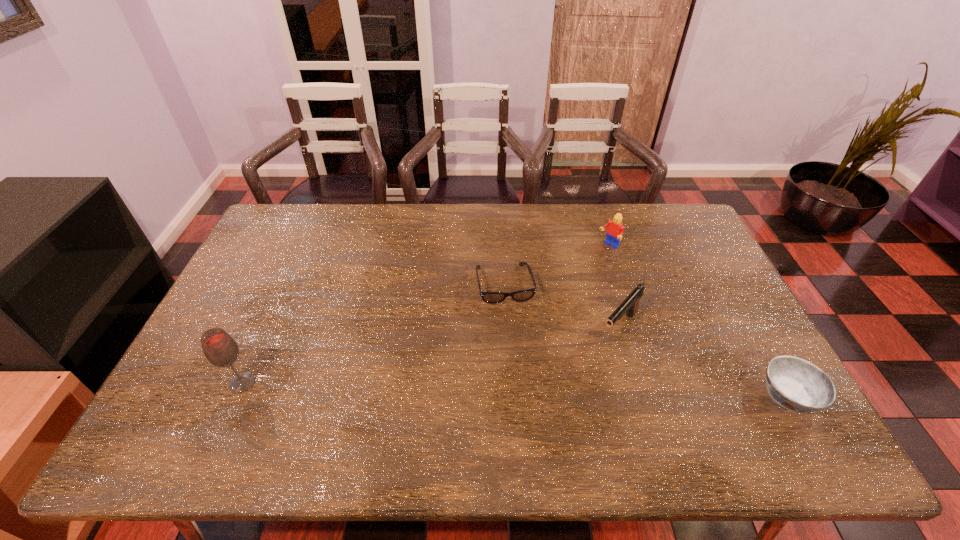
This screenshot has width=960, height=540. I want to click on empty space that is in between the glass drink container and the ashtray, so click(x=516, y=389).

The width and height of the screenshot is (960, 540). I want to click on free space between the second object from left to right and the tallest object, so click(x=373, y=334).

I want to click on vacant area that lies between the second object from left to right and the ashtray, so click(x=646, y=340).

Identify the location of vacant space in between the farthest object and the pistol. (614, 287).

Identify the location of free space between the farthest object and the rightmost object. This screenshot has width=960, height=540. (699, 321).

The height and width of the screenshot is (540, 960). In order to click on blank region between the farthest object and the pistol in this screenshot , I will do `click(614, 287)`.

Where is `vacant area that lies between the glass drink container and the farthest object`? The image size is (960, 540). vacant area that lies between the glass drink container and the farthest object is located at coordinates (425, 314).

At what (x,y) coordinates should I click in order to perform the action: click on empty space between the pistol and the rightmost object. Please return your answer as a coordinate pair (x, y). Looking at the image, I should click on (704, 362).

Identify the location of blank region between the glass drink container and the pistol. tap(431, 355).

Locate an element on the screen. Image resolution: width=960 pixels, height=540 pixels. empty location between the glass drink container and the spectacles is located at coordinates (373, 334).